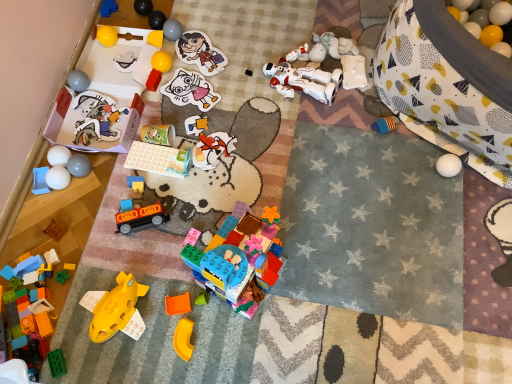
What do you see at coordinates (40, 181) in the screenshot? I see `blue plastic tray at lower left, placed as the 10th toy when sorted from bottom to top` at bounding box center [40, 181].

Locate an element on the screen. The width and height of the screenshot is (512, 384). orange matte train at center, the 8th toy in the bottom-to-top sequence is located at coordinates (141, 219).

What do you see at coordinates (183, 339) in the screenshot? I see `yellow plastic arch at lower center, which ranks as the 1th toy in bottom-to-top order` at bounding box center [183, 339].

At what (x,y) coordinates should I click in order to perform the action: click on translucent yellow plastic spaceship at lower left, the 24th toy when ordered from top to bottom. Please return your answer as a coordinate pair (x, y). Looking at the image, I should click on (61, 276).

Locate an element on the screen. blue plastic tray at lower left, marked as the eighteenth toy in a top-to-bottom arrangement is located at coordinates (40, 181).

Is matte paper sticker at center, the 17th toy positioned from the bottom, located within matte cardboard stickers at upper left, positioned as the 12th toy in top-to-bottom order?

No, matte paper sticker at center, the 17th toy positioned from the bottom, is located outside of matte cardboard stickers at upper left, positioned as the 12th toy in top-to-bottom order.

Which is more to the right, matte cardboard stickers at upper left, positioned as the 12th toy in top-to-bottom order, or matte paper sticker at center, the 17th toy positioned from the bottom?

From the viewer's perspective, matte paper sticker at center, the 17th toy positioned from the bottom, appears more on the right side.

Can you confirm if matte cardboard stickers at upper left, which ranks as the 16th toy in bottom-to-top order, is thinner than matte paper sticker at center, the 17th toy positioned from the bottom?

Yes, matte cardboard stickers at upper left, which ranks as the 16th toy in bottom-to-top order, is thinner than matte paper sticker at center, the 17th toy positioned from the bottom.

Find the location of `the 10th toy to the right when counting from the shiny black ball at upper center, arranged as the 26th toy when ordered from the bottom`. the 10th toy to the right when counting from the shiny black ball at upper center, arranged as the 26th toy when ordered from the bottom is located at coordinates (183, 339).

Is yellow plastic arch at lower center, placed as the 27th toy when sorted from top to bottom, to the left of shiny black ball at upper center, arranged as the 26th toy when ordered from the bottom, from the viewer's perspective?

No, yellow plastic arch at lower center, placed as the 27th toy when sorted from top to bottom, is not to the left of shiny black ball at upper center, arranged as the 26th toy when ordered from the bottom.

Are yellow plastic arch at lower center, which ranks as the 1th toy in bottom-to-top order, and shiny black ball at upper center, the second toy when ordered from top to bottom, making contact?

yellow plastic arch at lower center, which ranks as the 1th toy in bottom-to-top order, and shiny black ball at upper center, the second toy when ordered from top to bottom, are clearly separated.

Considering the relative sizes of yellow plastic arch at lower center, placed as the 27th toy when sorted from top to bottom, and shiny black ball at upper center, arranged as the 26th toy when ordered from the bottom, in the image provided, is yellow plastic arch at lower center, placed as the 27th toy when sorted from top to bottom, smaller than shiny black ball at upper center, arranged as the 26th toy when ordered from the bottom,?

Yes.

In the scene shown: Is there a large distance between matte plastic balls at left, the 17th toy positioned from the top, and black plastic toy at center, which is the 7th toy from top to bottom?

They are positioned close to each other.

Is matte plastic balls at left, the 11th toy when ordered from bottom to top, in front of or behind black plastic toy at center, the 21th toy when ordered from bottom to top, in the image?

Clearly, matte plastic balls at left, the 11th toy when ordered from bottom to top, is in front of black plastic toy at center, the 21th toy when ordered from bottom to top.

Who is shorter, matte plastic balls at left, the 11th toy when ordered from bottom to top, or black plastic toy at center, which is the 7th toy from top to bottom?

With less height is black plastic toy at center, which is the 7th toy from top to bottom.

Considering the relative sizes of black plastic toy at center, the 21th toy when ordered from bottom to top, and matte plastic balls at left, the 17th toy positioned from the top, in the image provided, is black plastic toy at center, the 21th toy when ordered from bottom to top, thinner than matte plastic balls at left, the 17th toy positioned from the top,?

Indeed, black plastic toy at center, the 21th toy when ordered from bottom to top, has a lesser width compared to matte plastic balls at left, the 17th toy positioned from the top.

From the image's perspective, which toy is the 10th one above the matte plastic balls at left, the 17th toy positioned from the top? Please provide its 2D coordinates.

[(248, 72)]

Does black plastic toy at center, the 21th toy when ordered from bottom to top, have a lesser height compared to matte plastic balls at left, the 17th toy positioned from the top?

Yes, black plastic toy at center, the 21th toy when ordered from bottom to top, is shorter than matte plastic balls at left, the 17th toy positioned from the top.

Is black plastic toy at center, the 21th toy when ordered from bottom to top, to the left of matte plastic balls at left, the 17th toy positioned from the top, from the viewer's perspective?

Incorrect, black plastic toy at center, the 21th toy when ordered from bottom to top, is not on the left side of matte plastic balls at left, the 17th toy positioned from the top.

Considering the positions of objects blue plastic tray at lower left, marked as the eighteenth toy in a top-to-bottom arrangement, and white matte robot at upper center, the 19th toy when ordered from bottom to top, in the image provided, who is more to the right, blue plastic tray at lower left, marked as the eighteenth toy in a top-to-bottom arrangement, or white matte robot at upper center, the 19th toy when ordered from bottom to top,?

From the viewer's perspective, white matte robot at upper center, the 19th toy when ordered from bottom to top, appears more on the right side.

Which is less distant, (47, 170) or (337, 58)?

Point (47, 170).

Measure the distance between blue plastic tray at lower left, placed as the 10th toy when sorted from bottom to top, and white matte robot at upper center, the 19th toy when ordered from bottom to top.

A distance of 37.13 inches exists between blue plastic tray at lower left, placed as the 10th toy when sorted from bottom to top, and white matte robot at upper center, the 19th toy when ordered from bottom to top.

Does blue plastic tray at lower left, marked as the eighteenth toy in a top-to-bottom arrangement, touch white matte robot at upper center, which is the ninth toy in top-to-bottom order?

No, blue plastic tray at lower left, marked as the eighteenth toy in a top-to-bottom arrangement, is not in contact with white matte robot at upper center, which is the ninth toy in top-to-bottom order.

Is black plastic toy at center, the 21th toy when ordered from bottom to top, further to camera compared to matte paper sticker at center, which appears as the eleventh toy when viewed from the top?

Yes, black plastic toy at center, the 21th toy when ordered from bottom to top, is further from the camera.

Considering the sizes of objects black plastic toy at center, which is the 7th toy from top to bottom, and matte paper sticker at center, the 17th toy positioned from the bottom, in the image provided, who is shorter, black plastic toy at center, which is the 7th toy from top to bottom, or matte paper sticker at center, the 17th toy positioned from the bottom,?

With less height is matte paper sticker at center, the 17th toy positioned from the bottom.

Considering the points (75, 87) and (152, 206), which point is in front, point (75, 87) or point (152, 206)?

The point (152, 206) is closer to the camera.

How many degrees apart are the facing directions of matte gray ball at upper left, which is counted as the tenth toy, starting from the top, and orange matte train at center, which appears as the 20th toy when viewed from the top?

24.2 degrees separate the facing orientations of matte gray ball at upper left, which is counted as the tenth toy, starting from the top, and orange matte train at center, which appears as the 20th toy when viewed from the top.

Is matte gray ball at upper left, the eighteenth toy ordered from the bottom, positioned behind orange matte train at center, which appears as the 20th toy when viewed from the top?

Yes.

From the matte cardboard stickers at upper left, which ranks as the 16th toy in bottom-to-top order, count 2nd toys backward and point to it. Please provide its 2D coordinates.

[(190, 90)]

You are a GUI agent. You are given a task and a screenshot of the screen. Output one action in this format:
    pyautogui.click(x=<x>, y=<y>)
    Task: Click on the 2nd toy directly above the shiny black ball at upper center, arranged as the 26th toy when ordered from the bottom (from a real-world perspective)
    
    Given the screenshot: What is the action you would take?
    pyautogui.click(x=183, y=339)

Based on their spatial positions, is matte green cup at center, which ranks as the 15th toy in bottom-to-top order, or matte cardboard stickers at upper left, which ranks as the 16th toy in bottom-to-top order, closer to shiny yellow ball at center, marked as the 22th toy in a bottom-to-top arrangement?

matte cardboard stickers at upper left, which ranks as the 16th toy in bottom-to-top order, lies closer to shiny yellow ball at center, marked as the 22th toy in a bottom-to-top arrangement, than the other object.

Which object lies nearer to the anchor point matte cardboard stickers at upper left, positioned as the 12th toy in top-to-bottom order, translucent orange plastic piece at center, the 3th toy ordered from the bottom, or translucent yellow plastic spaceship at lower left, the 24th toy when ordered from top to bottom?

translucent yellow plastic spaceship at lower left, the 24th toy when ordered from top to bottom, lies closer to matte cardboard stickers at upper left, positioned as the 12th toy in top-to-bottom order, than the other object.

Estimate the real-world distances between objects in this image. Which object is further from translucent plastic blocks at lower left, which appears as the fifth toy when ordered from the bottom, matte gray ball at upper left, the eighteenth toy ordered from the bottom, or orange matte toy at center, positioned as the 26th toy in top-to-bottom order?

matte gray ball at upper left, the eighteenth toy ordered from the bottom, lies further to translucent plastic blocks at lower left, which appears as the fifth toy when ordered from the bottom, than the other object.

From the image, which object appears to be nearer to brown matte block at lower left, the 21th toy in the top-to-bottom sequence, yellow plastic arch at lower center, placed as the 27th toy when sorted from top to bottom, or translucent plastic blocks at lower left, positioned as the 23th toy in top-to-bottom order?

Among the two, translucent plastic blocks at lower left, positioned as the 23th toy in top-to-bottom order, is located nearer to brown matte block at lower left, the 21th toy in the top-to-bottom sequence.

From the image, which object appears to be nearer to white matte robot at upper center, which is the ninth toy in top-to-bottom order, matte paper sticker at center, which appears as the eleventh toy when viewed from the top, or smooth gray balls at left, positioned as the 12th toy in bottom-to-top order?

matte paper sticker at center, which appears as the eleventh toy when viewed from the top, lies closer to white matte robot at upper center, which is the ninth toy in top-to-bottom order, than the other object.

Looking at the image, which one is located further to white plastic robot at upper right, the twentieth toy ordered from the bottom, translucent orange plastic piece at center, the 25th toy in the top-to-bottom sequence, or translucent yellow plastic spaceship at lower left, which is the 22th toy from top to bottom?

translucent yellow plastic spaceship at lower left, which is the 22th toy from top to bottom, is positioned further to the anchor white plastic robot at upper right, the twentieth toy ordered from the bottom.

Based on their spatial positions, is matte blue plastic toy at center, which is the nineteenth toy from top to bottom, or yellow rubber ball at upper left, the fourth toy from the top, further from matte green cup at center, the 13th toy viewed from the top?

yellow rubber ball at upper left, the fourth toy from the top, is further to matte green cup at center, the 13th toy viewed from the top.

Considering their positions, is yellow rubber ball at upper left, marked as the 24th toy in a bottom-to-top arrangement, positioned further to white plastic robot at upper right, acting as the 8th toy starting from the top, than translucent yellow plastic spaceship at lower left, which appears as the 4th toy when ordered from the bottom?

translucent yellow plastic spaceship at lower left, which appears as the 4th toy when ordered from the bottom.

Locate an element on the screen. This screenshot has height=384, width=512. toy between black plastic toy at center, which is the 7th toy from top to bottom, and white plastic robot at upper right, acting as the 8th toy starting from the top, in the horizontal direction is located at coordinates (319, 69).

At what (x,y) coordinates should I click in order to perform the action: click on toy that lies between brown matte block at lower left, the 21th toy in the top-to-bottom sequence, and translucent plastic blocks at lower left, positioned as the 23th toy in top-to-bottom order, from top to bottom. Please return your answer as a coordinate pair (x, y). Looking at the image, I should click on (69, 266).

Where is `toy between translucent orange plastic piece at center, the 25th toy in the top-to-bottom sequence, and yellow plastic arch at lower center, placed as the 27th toy when sorted from top to bottom, in the up-down direction`? This screenshot has width=512, height=384. toy between translucent orange plastic piece at center, the 25th toy in the top-to-bottom sequence, and yellow plastic arch at lower center, placed as the 27th toy when sorted from top to bottom, in the up-down direction is located at coordinates (177, 304).

I want to click on toy between white matte robot at upper center, which is the ninth toy in top-to-bottom order, and white rubber balloon at upper right from left to right, so click(353, 72).